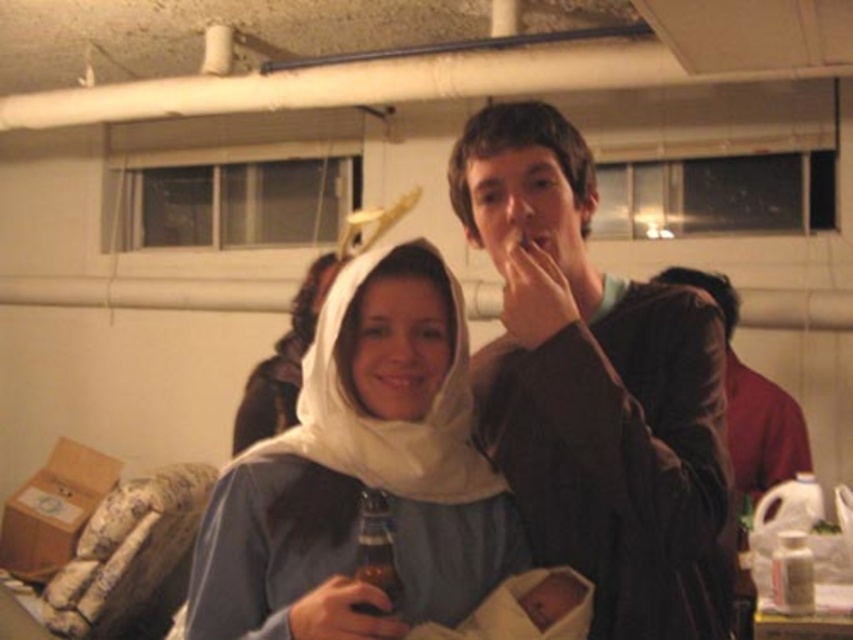
Is brown matte jacket at center positioned before dark brown leather jacket at right?

Yes, it is in front of dark brown leather jacket at right.

Which is in front, point (566, 122) or point (801, 445)?

Point (566, 122)

You are a GUI agent. You are given a task and a screenshot of the screen. Output one action in this format:
    pyautogui.click(x=<x>, y=<y>)
    Task: Click on the brown matte jacket at center
    This screenshot has width=853, height=640.
    Given the screenshot: What is the action you would take?
    pyautogui.click(x=599, y=394)

Can you confirm if white cloth at center is positioned to the right of brown glass bottle at center?

Indeed, white cloth at center is positioned on the right side of brown glass bottle at center.

Can you confirm if white cloth at center is positioned to the left of brown glass bottle at center?

No, white cloth at center is not to the left of brown glass bottle at center.

Which is in front, point (216, 636) or point (379, 572)?

Point (379, 572)

Find the location of a particular element. The image size is (853, 640). white cloth at center is located at coordinates (355, 486).

Identify the location of dark brown leather jacket at right. (750, 403).

Can you confirm if dark brown leather jacket at right is positioned to the left of brown glass bottle at center?

No, dark brown leather jacket at right is not to the left of brown glass bottle at center.

I want to click on dark brown leather jacket at right, so click(750, 403).

Locate an element on the screen. The width and height of the screenshot is (853, 640). dark brown leather jacket at right is located at coordinates (750, 403).